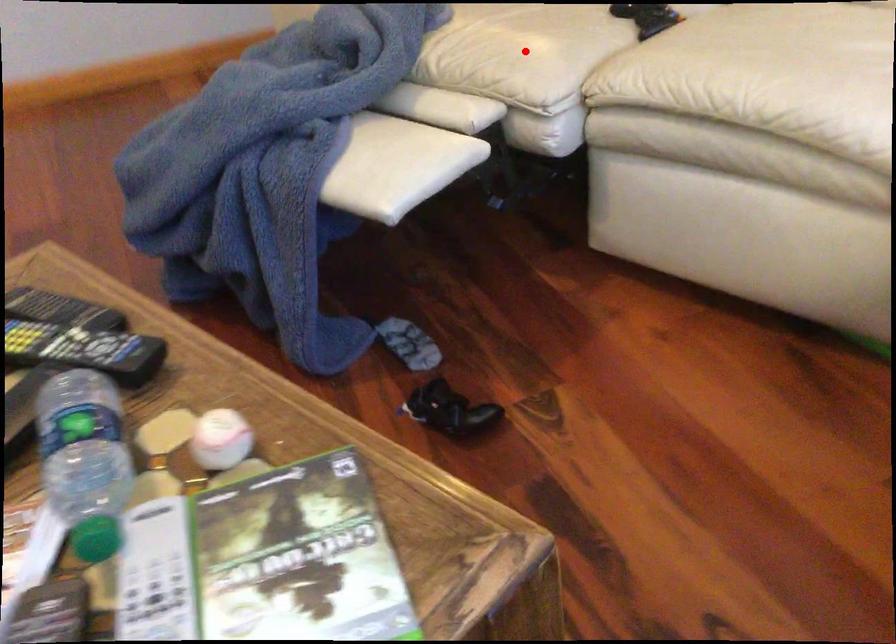
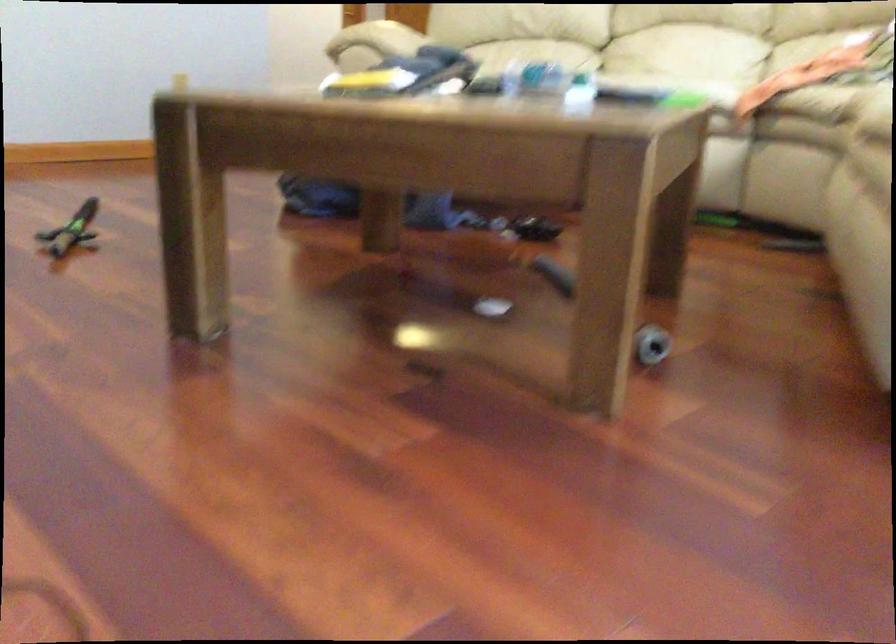
Question: I am providing you with two images of the same scene from different viewpoints. A red point is marked on the first image. At the location where the point appears in image 1, is it still visible in image 2?

Choices:
 (A) Yes
 (B) No

Answer: (B)